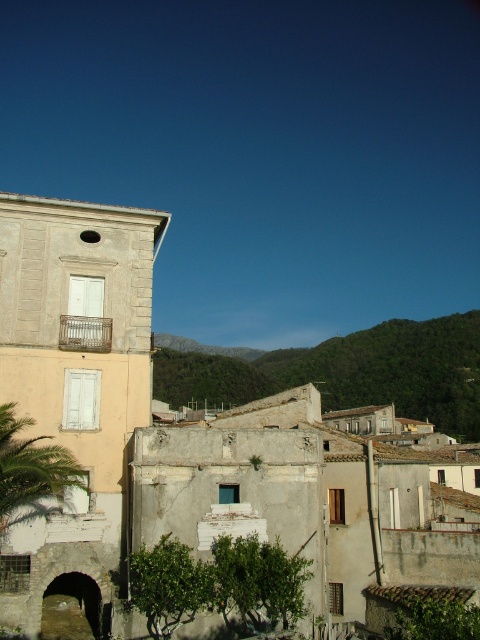
Question: Can you confirm if light beige stone building at left is positioned to the right of green leafy hillside at center?

Choices:
 (A) yes
 (B) no

Answer: (B)

Question: Does light beige stone building at left appear over green leafy hillside at center?

Choices:
 (A) yes
 (B) no

Answer: (A)

Question: Which of the following is the farthest from the observer?

Choices:
 (A) green leafy palm tree at lower left
 (B) light beige stone building at left

Answer: (B)

Question: Does light beige stone building at left have a larger size compared to green leafy hillside at center?

Choices:
 (A) yes
 (B) no

Answer: (B)

Question: Which point is closer to the camera?

Choices:
 (A) (228, 387)
 (B) (16, 493)

Answer: (B)

Question: Based on their relative distances, which object is nearer to the green leafy palm tree at lower left?

Choices:
 (A) green leafy hillside at center
 (B) light beige stone building at left

Answer: (B)